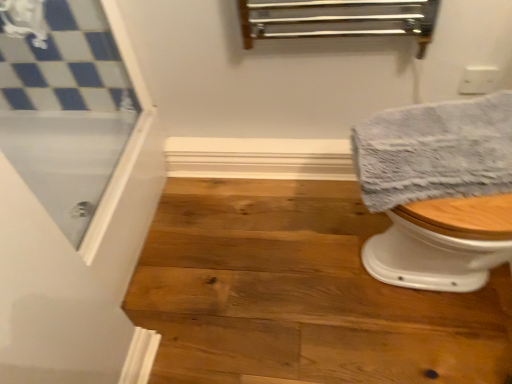
Where is `vacant space underneath clear glass screen door at upper left (from a real-world perspective)`? The width and height of the screenshot is (512, 384). vacant space underneath clear glass screen door at upper left (from a real-world perspective) is located at coordinates (121, 191).